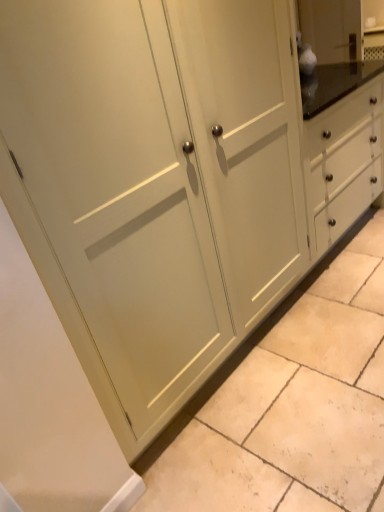
Measure the distance between beige matte tile at lower center and camera.

4.22 feet.

In order to face beige matte tile at lower center, should I rotate leftwards or rightwards?

Turn right approximately 21.274 degrees to face it.

Describe the element at coordinates (292, 405) in the screenshot. Image resolution: width=384 pixels, height=512 pixels. I see `beige matte tile at lower center` at that location.

At what (x,y) coordinates should I click in order to perform the action: click on beige matte tile at lower center. Please return your answer as a coordinate pair (x, y). This screenshot has height=512, width=384. Looking at the image, I should click on (292, 405).

Where is `beige matte tile at lower center`? This screenshot has width=384, height=512. beige matte tile at lower center is located at coordinates coord(292,405).